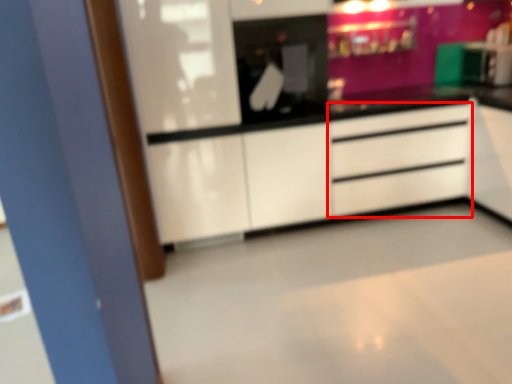
Question: In this image, where is chest of drawers (annotated by the red box) located relative to appliance?

Choices:
 (A) left
 (B) right

Answer: (B)